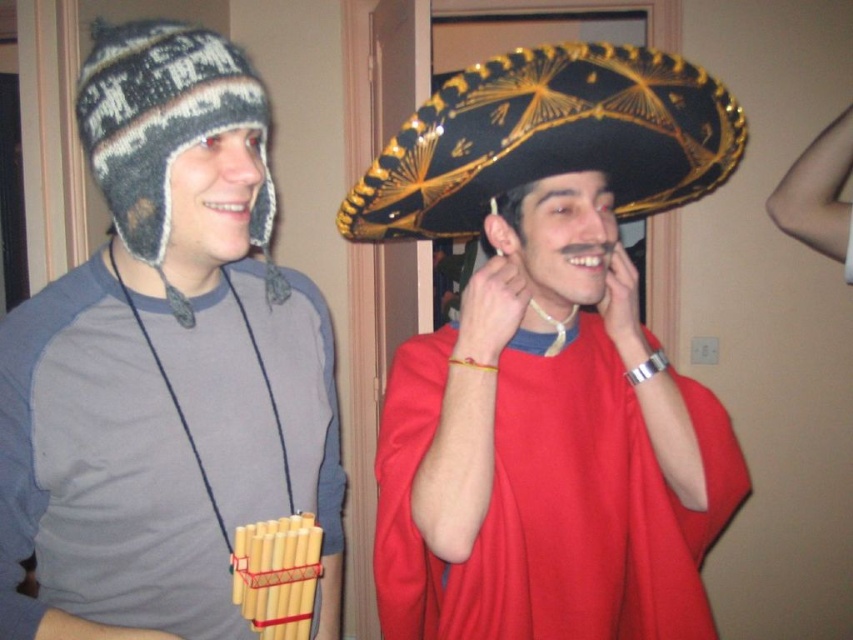
Question: Among these objects, which one is nearest to the camera?

Choices:
 (A) black felt sombrero at center
 (B) knitted woolen beanie at left
 (C) knitted wool beanie at left

Answer: (C)

Question: Which object is the closest to the knitted wool beanie at left?

Choices:
 (A) knitted woolen beanie at left
 (B) black felt sombrero at center

Answer: (A)

Question: Does knitted wool beanie at left appear under black felt sombrero at center?

Choices:
 (A) yes
 (B) no

Answer: (A)

Question: Considering the relative positions of knitted wool beanie at left and black felt sombrero at center in the image provided, where is knitted wool beanie at left located with respect to black felt sombrero at center?

Choices:
 (A) right
 (B) left

Answer: (B)

Question: Is knitted wool beanie at left in front of knitted woolen beanie at left?

Choices:
 (A) yes
 (B) no

Answer: (A)

Question: Which of the following is the closest to the observer?

Choices:
 (A) black felt sombrero at center
 (B) knitted woolen beanie at left

Answer: (B)